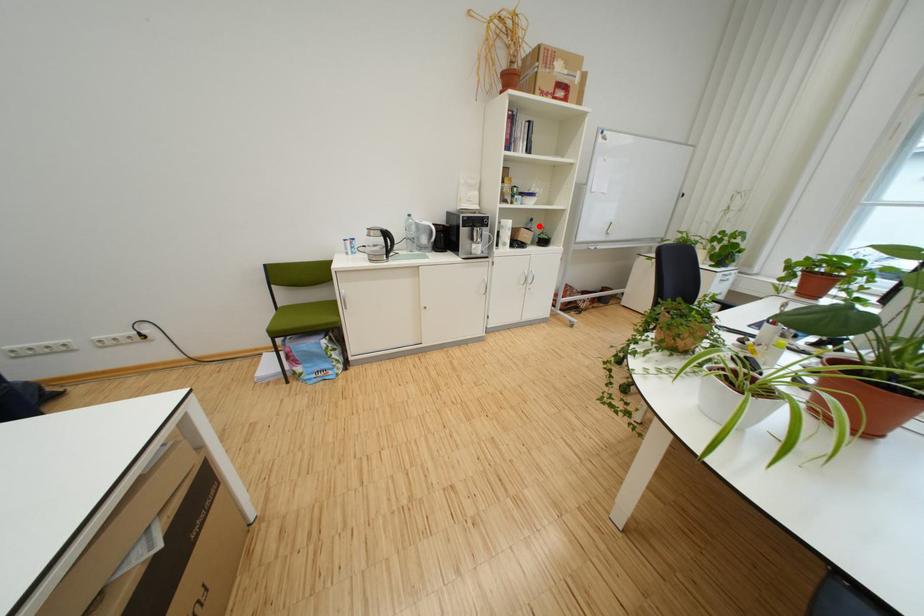
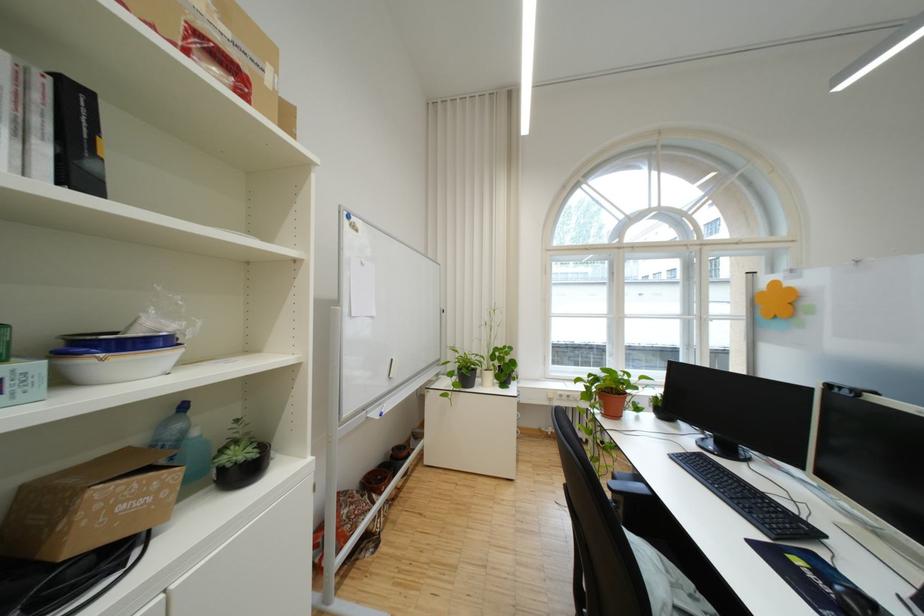
Locate, in the second image, the point that corresponds to the highlighted location in the first image.

(176, 426)